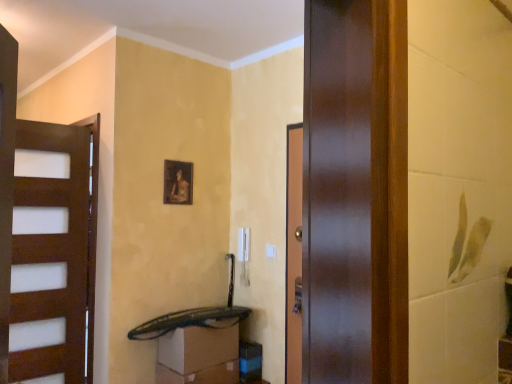
Question: Considering the positions of black plastic drawer at lower center, placed as the 1th drawer when sorted from top to bottom, and matte wooden picture frame at center in the image, is black plastic drawer at lower center, placed as the 1th drawer when sorted from top to bottom, bigger or smaller than matte wooden picture frame at center?

Choices:
 (A) big
 (B) small

Answer: (A)

Question: From a real-world perspective, relative to matte wooden picture frame at center, is black plastic drawer at lower center, which is the 2th drawer in bottom-to-top order, vertically above or below?

Choices:
 (A) below
 (B) above

Answer: (A)

Question: Which of these objects is positioned farthest from the black plastic drawer at lower center, which is the 2th drawer in bottom-to-top order?

Choices:
 (A) matte wooden picture frame at center
 (B) matte white drawer at lower center, which appears as the 2th drawer when viewed from the top

Answer: (A)

Question: Based on their relative distances, which object is nearer to the black plastic drawer at lower center, placed as the 1th drawer when sorted from top to bottom?

Choices:
 (A) matte white drawer at lower center, the 1th drawer ordered from the bottom
 (B) matte wooden picture frame at center

Answer: (A)